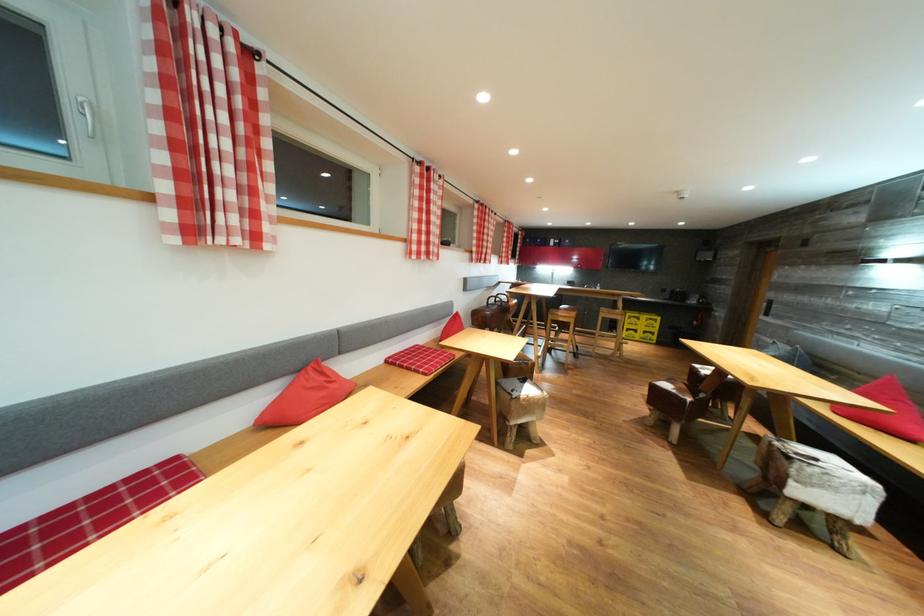
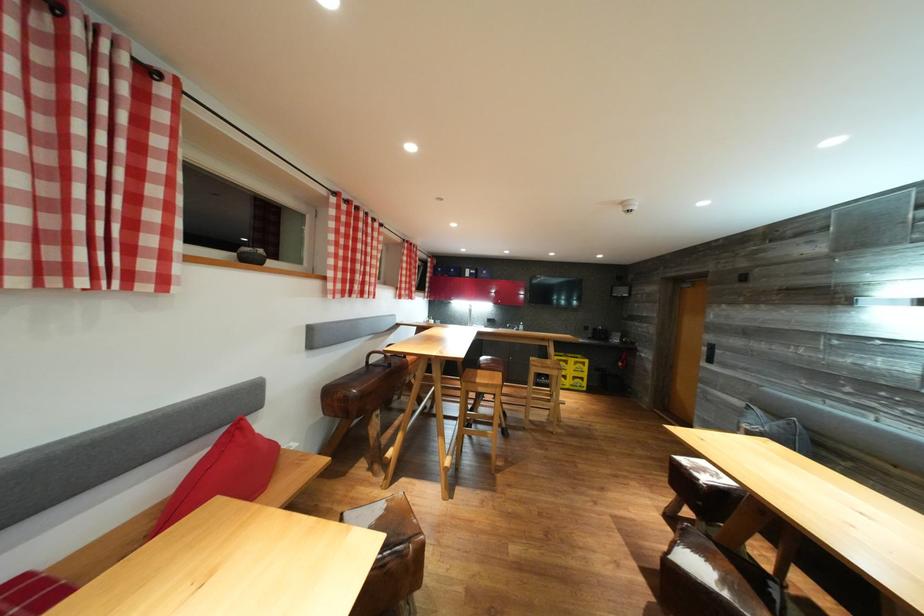
Locate, in the second image, the point that corresponds to point (572, 322) in the first image.

(492, 391)